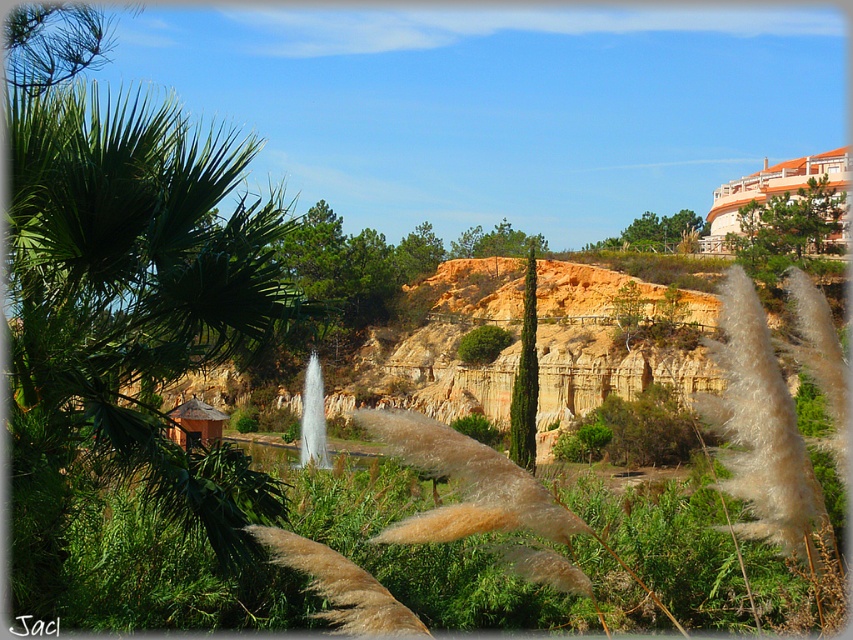
You are planning to place a new bench in this outdoor area. The bench requires a space that is wider than the green leafy palm tree at left. Can the area near the white glossy fountain at center accommodate the bench?

The green leafy palm tree at left is wider than the white glossy fountain at center. Since the bench requires a space wider than the palm tree, the area near the white glossy fountain at center is not wide enough to accommodate the bench.